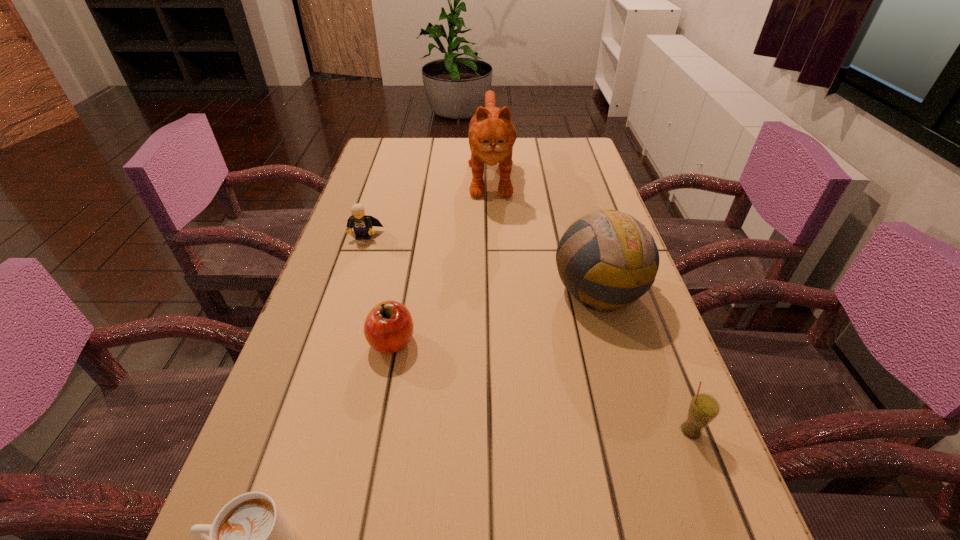
Locate an element on the screen. Image resolution: width=960 pixels, height=540 pixels. vacant area situated on the front-facing side of the Lego is located at coordinates (337, 318).

Where is `vacant region located on the front of the fourth object from right to left`? The image size is (960, 540). vacant region located on the front of the fourth object from right to left is located at coordinates (374, 436).

Locate an element on the screen. This screenshot has height=540, width=960. object that is at the far edge is located at coordinates (492, 134).

Find the location of `Lego located in the left edge section of the desktop`. Lego located in the left edge section of the desktop is located at coordinates (362, 224).

This screenshot has height=540, width=960. Find the location of `apple situated at the left edge`. apple situated at the left edge is located at coordinates (388, 328).

Locate an element on the screen. This screenshot has width=960, height=540. volleyball present at the right edge is located at coordinates (607, 259).

Identify the location of straw for drinking situated at the right edge. (703, 409).

Where is `free space at the far edge of the desktop`? The width and height of the screenshot is (960, 540). free space at the far edge of the desktop is located at coordinates (465, 162).

What are the coordinates of `vacant space at the left edge` in the screenshot? It's located at (371, 265).

Where is `free space at the right edge`? The height and width of the screenshot is (540, 960). free space at the right edge is located at coordinates (650, 531).